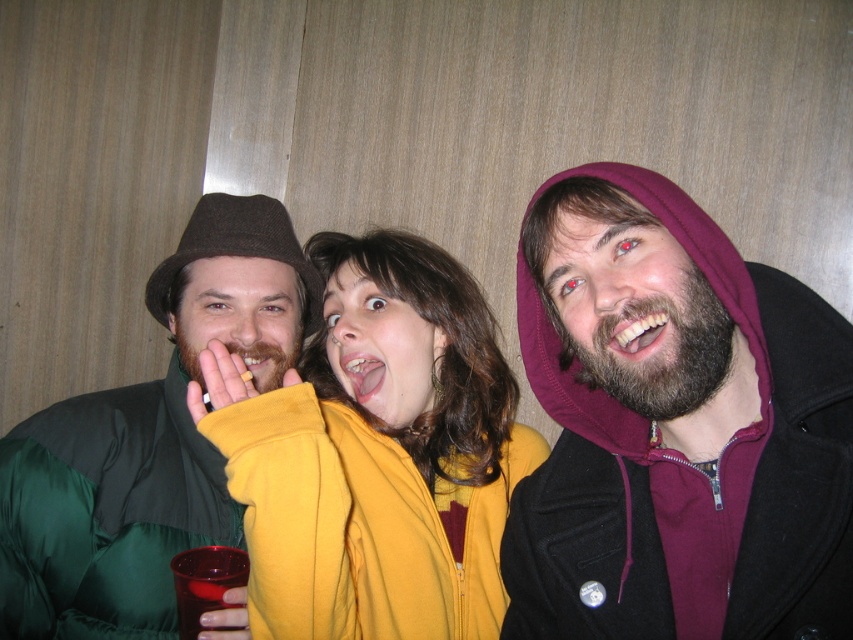
You are standing in front of the image and want to know how far the point at coordinates point (660, 291) is from you. Can you determine the distance?

The point at coordinates point (660, 291) is 25.51 inches away from the viewer.

You are standing in the room and want to hand a gift to the person wearing the green satin jacket at left. Based on their position relative to you, where should you approach from to ensure you are facing them directly?

Since the green satin jacket at left is located at point (148, 440), you should approach from the right side to face them directly.